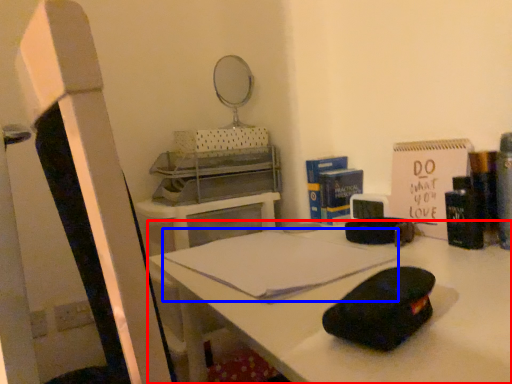
Question: Among these objects, which one is farthest to the camera, desk (highlighted by a red box) or notebook (highlighted by a blue box)?

Choices:
 (A) desk
 (B) notebook

Answer: (B)